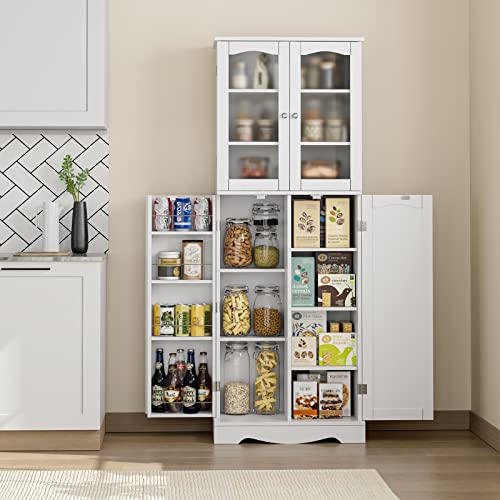
Where is `items in glass jars`? The height and width of the screenshot is (500, 500). items in glass jars is located at coordinates (234, 241), (261, 241), (242, 317), (262, 312), (239, 399), (265, 394).